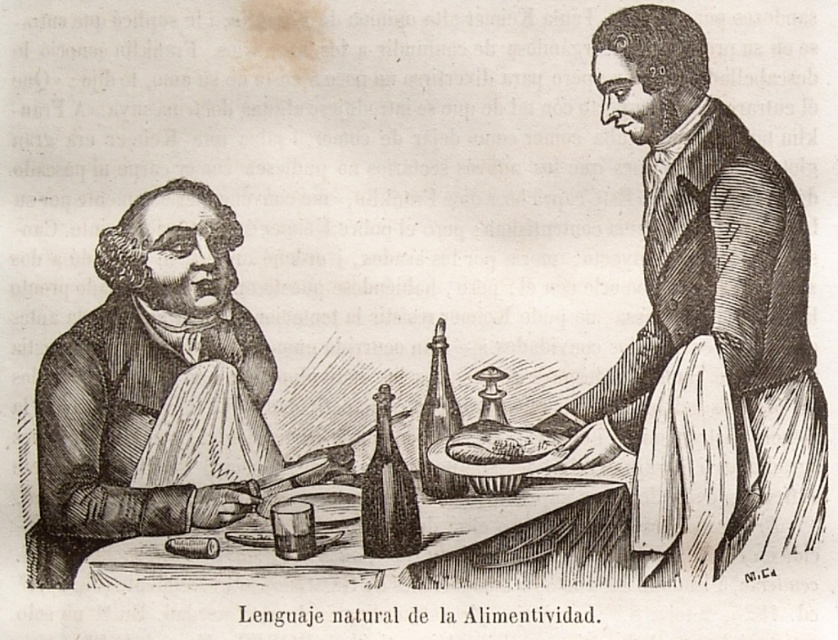
Is smooth glass bottle at center in front of smooth brown bread at center?

Yes, it is in front of smooth brown bread at center.

Consider the image. Can you confirm if smooth glass bottle at center is wider than smooth brown bread at center?

No, smooth glass bottle at center is not wider than smooth brown bread at center.

This screenshot has height=640, width=838. What are the coordinates of `smooth glass bottle at center` in the screenshot? It's located at (386, 492).

Between point (759, 307) and point (508, 516), which one is positioned behind?

The point (759, 307) is behind.

Between smooth black coat at right and smooth wood table at center, which one has more height?

Standing taller between the two is smooth black coat at right.

Is point (808, 240) farther from camera compared to point (132, 582)?

Yes, point (808, 240) is behind point (132, 582).

You are a GUI agent. You are given a task and a screenshot of the screen. Output one action in this format:
    pyautogui.click(x=<x>, y=<y>)
    Task: Click on the smooth black coat at right
    The width and height of the screenshot is (838, 640).
    Given the screenshot: What is the action you would take?
    pyautogui.click(x=705, y=323)

Is smooth black coat at right to the left of smooth brown bread at center from the viewer's perspective?

In fact, smooth black coat at right is to the right of smooth brown bread at center.

Does point (676, 497) come farther from viewer compared to point (480, 445)?

Yes, it is behind point (480, 445).

Who is more distant from viewer, (799,532) or (533,435)?

The point (799,532) is more distant.

I want to click on smooth black coat at right, so 705,323.